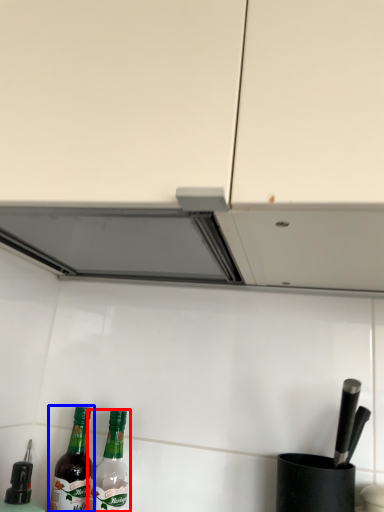
Question: Which object is further to the camera taking this photo, bottle (highlighted by a red box) or bottle (highlighted by a blue box)?

Choices:
 (A) bottle
 (B) bottle

Answer: (B)